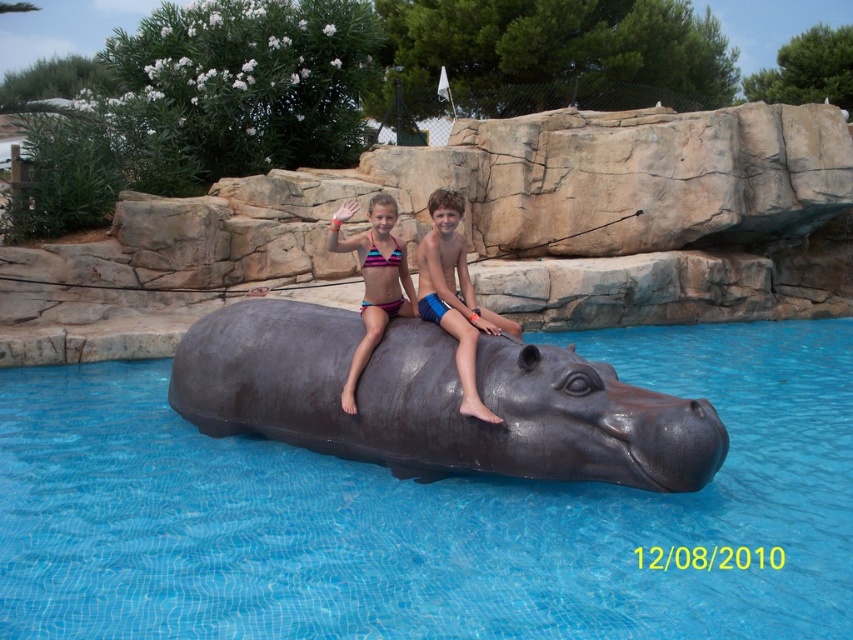
Based on the scene description, where is the shiny dark gray hippo at center located in relation to the point with coordinates (434, 401)?

The point with coordinates (434, 401) corresponds to the shiny dark gray hippo at center, so they are in the same location.